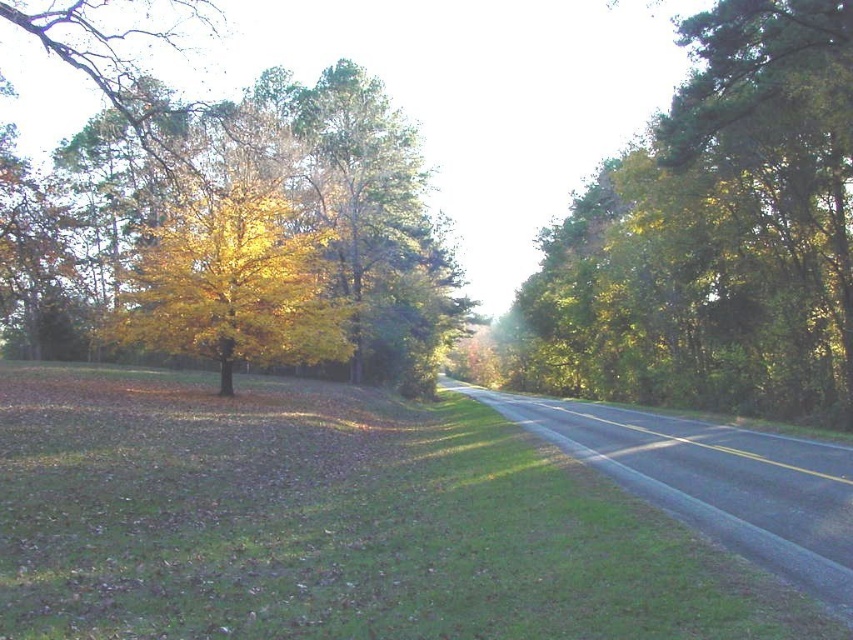
Question: Which of the following is the closest to the observer?

Choices:
 (A) (190, 154)
 (B) (780, 19)

Answer: (B)

Question: Is green leafy tree at right closer to the viewer compared to yellow/golden leaves at left?

Choices:
 (A) yes
 (B) no

Answer: (B)

Question: From the image, what is the correct spatial relationship of green leafy tree at right in relation to yellow/golden leaves at left?

Choices:
 (A) right
 (B) left

Answer: (A)

Question: Which point is closer to the camera?

Choices:
 (A) (730, 259)
 (B) (392, 116)

Answer: (A)

Question: Is green leafy tree at right to the right of yellow/golden leaves at left from the viewer's perspective?

Choices:
 (A) no
 (B) yes

Answer: (B)